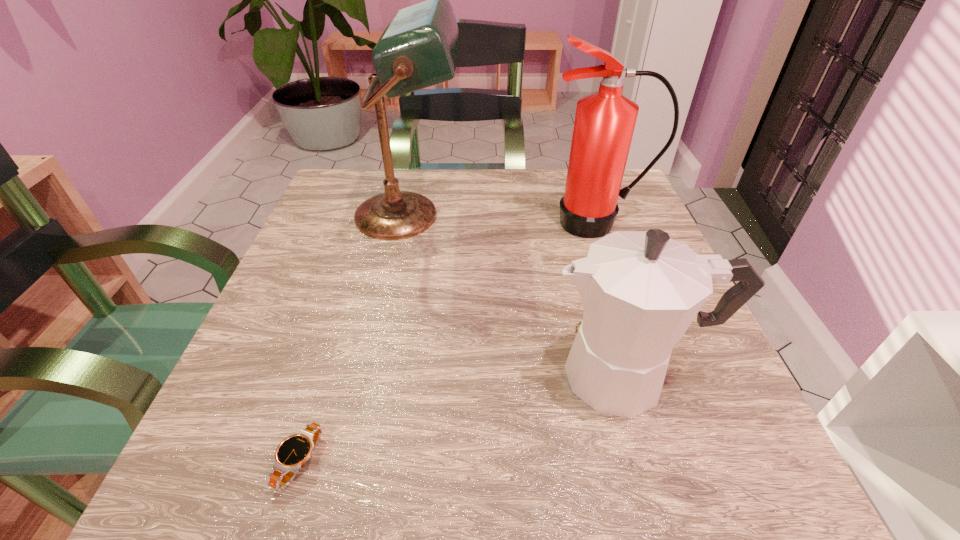
Identify the location of vacant position located at the spout of the second shortest object. The width and height of the screenshot is (960, 540). (448, 375).

Locate an element on the screen. The height and width of the screenshot is (540, 960). vacant space situated on the right of the nearest object is located at coordinates pos(396,462).

This screenshot has width=960, height=540. Find the location of `table lamp that is at the far edge`. table lamp that is at the far edge is located at coordinates (418, 49).

At what (x,y) coordinates should I click in order to perform the action: click on fire extinguisher present at the far edge. Please return your answer as a coordinate pair (x, y). Looking at the image, I should click on (604, 124).

Find the location of a particular element. Image resolution: width=960 pixels, height=540 pixels. object present at the near edge is located at coordinates pos(291,454).

Where is `table lamp located at the left edge`? Image resolution: width=960 pixels, height=540 pixels. table lamp located at the left edge is located at coordinates (418, 49).

The width and height of the screenshot is (960, 540). I want to click on watch present at the left edge, so click(x=291, y=454).

The height and width of the screenshot is (540, 960). Find the location of `fire extinguisher present at the right edge`. fire extinguisher present at the right edge is located at coordinates pos(604,124).

Where is `coffeepot located in the right edge section of the desktop`? coffeepot located in the right edge section of the desktop is located at coordinates (641, 290).

At what (x,y) coordinates should I click in order to perform the action: click on object present at the far left corner. Please return your answer as a coordinate pair (x, y). Image resolution: width=960 pixels, height=540 pixels. Looking at the image, I should click on (418, 49).